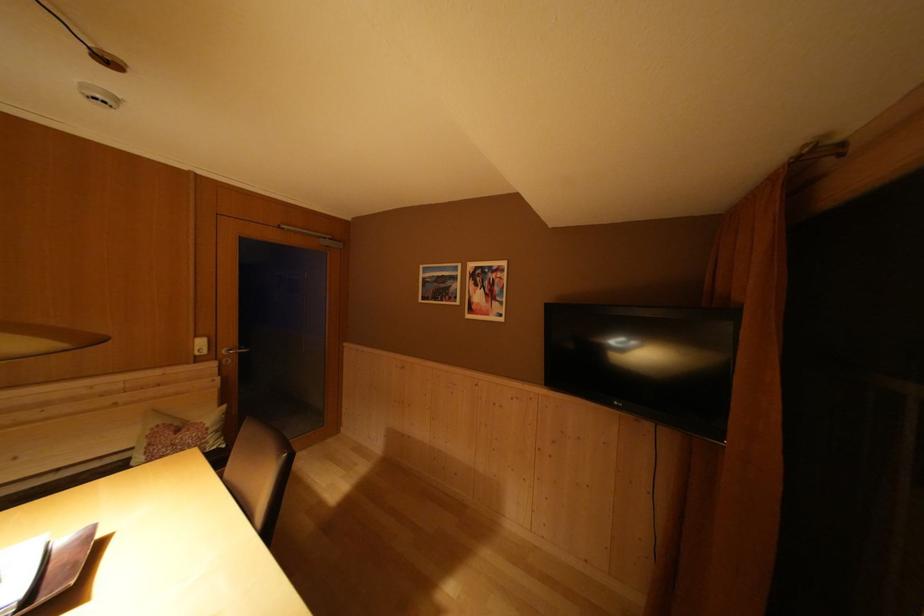
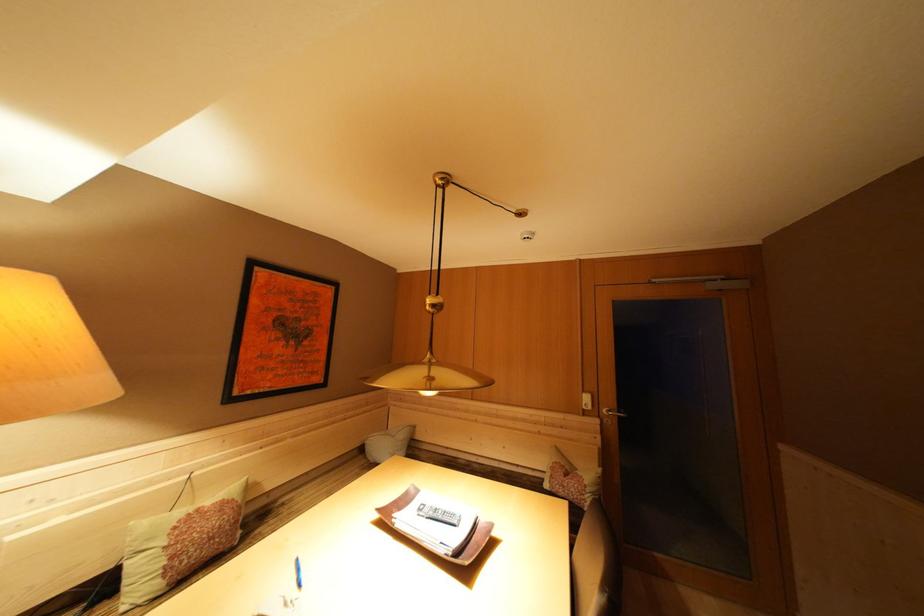
The point at (220, 360) is marked in the first image. Where is the corresponding point in the second image?

(602, 418)